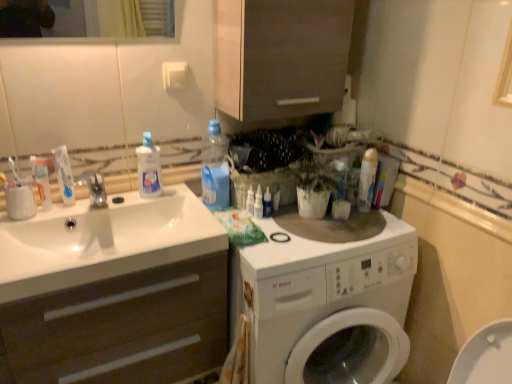
What is the approximate width of white glossy washing machine at center?

It is 26.79 inches.

Identify the location of white matte cabinet at left. The width and height of the screenshot is (512, 384). (122, 327).

At what (x,y) coordinates should I click in order to perform the action: click on matte brown cabinet at upper center. Please return your answer as a coordinate pair (x, y). Looking at the image, I should click on (281, 57).

This screenshot has width=512, height=384. What do you see at coordinates (276, 197) in the screenshot? I see `white glossy bottle at center, which ranks as the first toiletry in right-to-left order` at bounding box center [276, 197].

The image size is (512, 384). What do you see at coordinates (250, 201) in the screenshot?
I see `white glossy bottle at center, placed as the 3th toiletry when sorted from right to left` at bounding box center [250, 201].

At what (x,y) coordinates should I click in order to perform the action: click on white glossy washing machine at center. Please return your answer as a coordinate pair (x, y). Image resolution: width=512 pixels, height=384 pixels. Looking at the image, I should click on (326, 298).

Between transparent plastic spray bottle at center, the 2th cleaning product when ordered from right to left, and white glossy bottle at center, which is counted as the second toiletry, starting from the left, which one has more height?

transparent plastic spray bottle at center, the 2th cleaning product when ordered from right to left, is taller.

Can you confirm if transparent plastic spray bottle at center, the 2th cleaning product when ordered from right to left, is positioned to the left of white glossy bottle at center, which is counted as the second toiletry, starting from the left?

Yes.

From the image's perspective, would you say transparent plastic spray bottle at center, which appears as the 3th cleaning product when viewed from the left, is positioned over white glossy bottle at center, which is counted as the second toiletry, starting from the left?

No, from the image's perspective, transparent plastic spray bottle at center, which appears as the 3th cleaning product when viewed from the left, is not over white glossy bottle at center, which is counted as the second toiletry, starting from the left.

Are transparent plastic spray bottle at center, the 2th cleaning product when ordered from right to left, and white glossy bottle at center, placed as the 2th toiletry when sorted from right to left, making contact?

Yes.

Relative to transparent plastic bottle at upper left, the 1th cleaning product from the left, is white glossy bottle at center, placed as the 3th toiletry when sorted from right to left, in front or behind?

white glossy bottle at center, placed as the 3th toiletry when sorted from right to left, is positioned farther from the viewer than transparent plastic bottle at upper left, the 1th cleaning product from the left.

Would you say white glossy bottle at center, placed as the 3th toiletry when sorted from right to left, is to the left or to the right of transparent plastic bottle at upper left, the 1th cleaning product from the left, in the picture?

From the image, it's evident that white glossy bottle at center, placed as the 3th toiletry when sorted from right to left, is to the right of transparent plastic bottle at upper left, the 1th cleaning product from the left.

Is white glossy bottle at center, placed as the 3th toiletry when sorted from right to left, not inside transparent plastic bottle at upper left, placed as the fourth cleaning product when sorted from right to left?

white glossy bottle at center, placed as the 3th toiletry when sorted from right to left, lies outside transparent plastic bottle at upper left, placed as the fourth cleaning product when sorted from right to left,'s area.

From a real-world perspective, which is physically below, white glossy bottle at center, placed as the 3th toiletry when sorted from right to left, or transparent plastic bottle at upper left, the 1th cleaning product from the left?

white glossy bottle at center, placed as the 3th toiletry when sorted from right to left, from a real-world perspective.

From the image's perspective, does white glossy toothpaste at left, which appears as the second toothpaste when viewed from the left, appear lower than blue plastic bottle at upper center, positioned as the 3th cleaning product in right-to-left order?

Indeed, from the image's perspective, white glossy toothpaste at left, which appears as the second toothpaste when viewed from the left, is shown beneath blue plastic bottle at upper center, positioned as the 3th cleaning product in right-to-left order.

Looking at this image, considering the positions of objects white glossy toothpaste at left, the 1th toothpaste when ordered from right to left, and blue plastic bottle at upper center, the second cleaning product in the left-to-right sequence, in the image provided, who is behind, white glossy toothpaste at left, the 1th toothpaste when ordered from right to left, or blue plastic bottle at upper center, the second cleaning product in the left-to-right sequence,?

blue plastic bottle at upper center, the second cleaning product in the left-to-right sequence, is more distant.

Identify the location of bathroom cabinet below the transparent plastic bottle at upper left, the 1th cleaning product from the left (from the image's perspective). The image size is (512, 384). (122, 327).

From a real-world perspective, is transparent plastic bottle at upper left, placed as the fourth cleaning product when sorted from right to left, under white matte cabinet at left?

No, from a real-world perspective, transparent plastic bottle at upper left, placed as the fourth cleaning product when sorted from right to left, is not beneath white matte cabinet at left.

Is transparent plastic bottle at upper left, the 1th cleaning product from the left, looking in the opposite direction of white matte cabinet at left?

No, transparent plastic bottle at upper left, the 1th cleaning product from the left, is not facing away from white matte cabinet at left.

Considering the sizes of objects transparent plastic bottle at upper left, the 1th cleaning product from the left, and white matte cabinet at left in the image provided, who is wider, transparent plastic bottle at upper left, the 1th cleaning product from the left, or white matte cabinet at left?

white matte cabinet at left.

Locate an element on the screen. the 2nd toothpaste in front of the white glossy bottle at center, which ranks as the first toiletry in right-to-left order, starting your count from the anchor is located at coordinates (42, 181).

Which is more to the right, white glossy bottle at center, which ranks as the first toiletry in right-to-left order, or white glossy toothpaste at sink, the 2th toothpaste when ordered from right to left?

white glossy bottle at center, which ranks as the first toiletry in right-to-left order, is more to the right.

Between white glossy bottle at center, which ranks as the first toiletry in right-to-left order, and white glossy toothpaste at sink, marked as the first toothpaste in a left-to-right arrangement, which one has less height?

white glossy bottle at center, which ranks as the first toiletry in right-to-left order.

Are white glossy bottle at center, which ranks as the 3th toiletry in left-to-right order, and white glossy toothpaste at sink, marked as the first toothpaste in a left-to-right arrangement, beside each other?

They are not placed beside each other.

At what (x,y) coordinates should I click in order to perform the action: click on cleaning product on the right of white glossy bottle at center, placed as the 2th toiletry when sorted from right to left. Please return your answer as a coordinate pair (x, y). The image size is (512, 384). Looking at the image, I should click on (367, 180).

Based on the photo, between white glossy spray can at upper right, the 1th cleaning product from the right, and white glossy bottle at center, which is counted as the second toiletry, starting from the left, which one has less height?

Standing shorter between the two is white glossy bottle at center, which is counted as the second toiletry, starting from the left.

Is point (375, 172) positioned behind point (266, 212)?

Yes, it is.

Can you confirm if white glossy spray can at upper right, the 1th cleaning product from the right, is bigger than white glossy bottle at center, placed as the 2th toiletry when sorted from right to left?

Correct, white glossy spray can at upper right, the 1th cleaning product from the right, is larger in size than white glossy bottle at center, placed as the 2th toiletry when sorted from right to left.

Can you confirm if white glossy spray can at upper right, arranged as the fourth cleaning product when viewed from the left, is wider than white glossy washing machine at center?

No.

Are white glossy spray can at upper right, the 1th cleaning product from the right, and white glossy washing machine at center located far from each other?

They are positioned close to each other.

Which point is more distant from viewer, (365,169) or (231,268)?

The point (365,169) is farther.

From a real-world perspective, between white glossy spray can at upper right, the 1th cleaning product from the right, and white glossy washing machine at center, who is vertically higher?

In real-world perspective, white glossy spray can at upper right, the 1th cleaning product from the right, is above.

From the white glossy bottle at center, which is counted as the second toiletry, starting from the left, count the 1st cleaning product to the left and point to it. Please provide its 2D coordinates.

[(258, 203)]

This screenshot has height=384, width=512. Find the location of `toiletry that is the 1st one when counting backward from the transparent plastic bottle at upper left, the 1th cleaning product from the left`. toiletry that is the 1st one when counting backward from the transparent plastic bottle at upper left, the 1th cleaning product from the left is located at coordinates (250, 201).

Which object lies further to the anchor point transparent plastic spray bottle at center, the 2th cleaning product when ordered from right to left, matte brown cabinet at upper center or white glossy bottle at center, the 1th toiletry in the left-to-right sequence?

Based on the image, matte brown cabinet at upper center appears to be further to transparent plastic spray bottle at center, the 2th cleaning product when ordered from right to left.

When comparing their distances from white matte cabinet at left, does white glossy bottle at center, which ranks as the 3th toiletry in left-to-right order, or white glossy bottle at center, the 1th toiletry in the left-to-right sequence, seem further?

white glossy bottle at center, which ranks as the 3th toiletry in left-to-right order, is further to white matte cabinet at left.

When comparing their distances from white glossy bottle at center, which ranks as the 3th toiletry in left-to-right order, does white glossy toothpaste at left, which appears as the second toothpaste when viewed from the left, or transparent plastic bottle at upper left, the 1th cleaning product from the left, seem further?

white glossy toothpaste at left, which appears as the second toothpaste when viewed from the left, lies further to white glossy bottle at center, which ranks as the 3th toiletry in left-to-right order, than the other object.

Considering their positions, is transparent plastic spray bottle at center, the 2th cleaning product when ordered from right to left, positioned closer to white glossy toothpaste at left, the 1th toothpaste when ordered from right to left, than white glossy bottle at center, which is counted as the second toiletry, starting from the left?

The object closer to white glossy toothpaste at left, the 1th toothpaste when ordered from right to left, is transparent plastic spray bottle at center, the 2th cleaning product when ordered from right to left.

In the scene shown: When comparing their distances from blue plastic bottle at upper center, positioned as the 3th cleaning product in right-to-left order, does white glossy toothpaste at sink, the 2th toothpaste when ordered from right to left, or transparent plastic spray bottle at center, which appears as the 3th cleaning product when viewed from the left, seem closer?

Among the two, transparent plastic spray bottle at center, which appears as the 3th cleaning product when viewed from the left, is located nearer to blue plastic bottle at upper center, positioned as the 3th cleaning product in right-to-left order.

From the image, which object appears to be nearer to white glossy bottle at center, which is counted as the second toiletry, starting from the left, white glossy toothpaste at left, which appears as the second toothpaste when viewed from the left, or transparent plastic bottle at upper left, placed as the fourth cleaning product when sorted from right to left?

transparent plastic bottle at upper left, placed as the fourth cleaning product when sorted from right to left, is positioned closer to the anchor white glossy bottle at center, which is counted as the second toiletry, starting from the left.

Based on their spatial positions, is white glossy sink at left or white glossy bottle at center, the 1th toiletry in the left-to-right sequence, closer to white matte cabinet at left?

white glossy sink at left.

When comparing their distances from white glossy toothpaste at sink, marked as the first toothpaste in a left-to-right arrangement, does white glossy toothpaste at left, which appears as the second toothpaste when viewed from the left, or white glossy washing machine at center seem further?

Based on the image, white glossy washing machine at center appears to be further to white glossy toothpaste at sink, marked as the first toothpaste in a left-to-right arrangement.

At what (x,y) coordinates should I click in order to perform the action: click on bathroom cabinet between white glossy toothpaste at sink, the 2th toothpaste when ordered from right to left, and white glossy bottle at center, the 1th toiletry in the left-to-right sequence, in the horizontal direction. Please return your answer as a coordinate pair (x, y). This screenshot has width=512, height=384. Looking at the image, I should click on (122, 327).

You are a GUI agent. You are given a task and a screenshot of the screen. Output one action in this format:
    pyautogui.click(x=<x>, y=<y>)
    Task: Click on the cleaning product between blue plastic bottle at upper center, the second cleaning product in the left-to-right sequence, and white glossy bottle at center, which is counted as the second toiletry, starting from the left
    Image resolution: width=512 pixels, height=384 pixels.
    Given the screenshot: What is the action you would take?
    pyautogui.click(x=258, y=203)

I want to click on bathroom cabinet between white glossy toothpaste at left, the 1th toothpaste when ordered from right to left, and white glossy bottle at center, placed as the 2th toiletry when sorted from right to left, so click(x=122, y=327).

Locate an element on the screen. The image size is (512, 384). sink located between white matte cabinet at left and white glossy washing machine at center in the left-right direction is located at coordinates (104, 240).